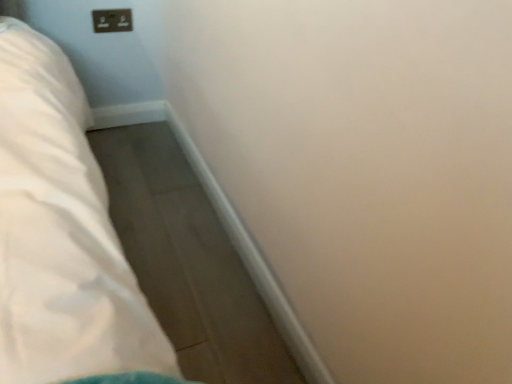
Image resolution: width=512 pixels, height=384 pixels. What are the coordinates of `matte black outlet at upper left` in the screenshot? It's located at (112, 20).

This screenshot has width=512, height=384. What do you see at coordinates (112, 20) in the screenshot? I see `matte black outlet at upper left` at bounding box center [112, 20].

What is the approximate width of matte black outlet at upper left?

It is 0.61 inches.

Find the location of a particular element. matte black outlet at upper left is located at coordinates (112, 20).